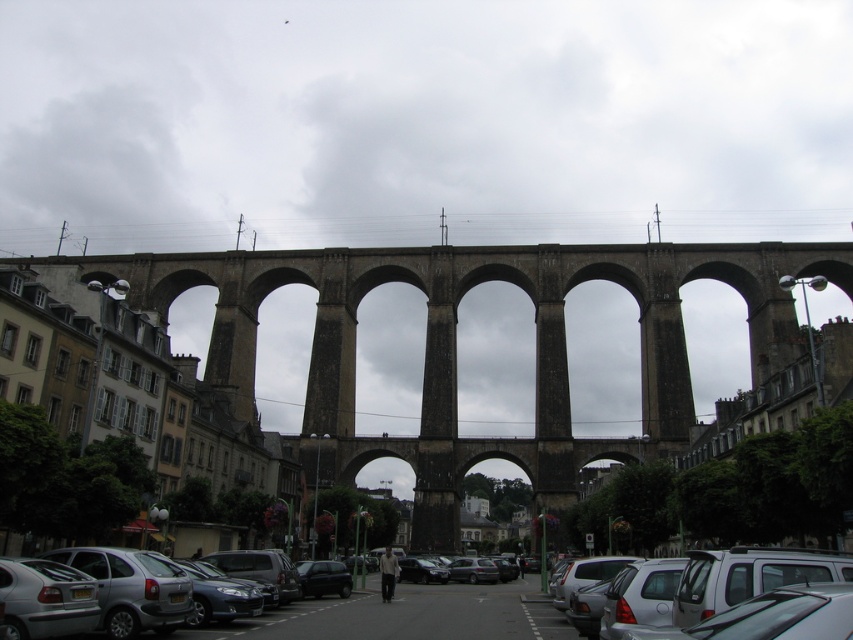
Question: Does silver metallic car at lower left lie in front of shiny black car at center?

Choices:
 (A) no
 (B) yes

Answer: (B)

Question: Can you confirm if brown stone bridge at center is wider than silver metallic car at lower right?

Choices:
 (A) yes
 (B) no

Answer: (A)

Question: Can you confirm if brown stone bridge at center is wider than silver metallic car at lower right?

Choices:
 (A) no
 (B) yes

Answer: (B)

Question: Among these objects, which one is nearest to the camera?

Choices:
 (A) brown stone bridge at center
 (B) silver metallic car at lower left

Answer: (B)

Question: Which point is farther to the camera?

Choices:
 (A) (90, 588)
 (B) (654, 604)
 (C) (343, 572)

Answer: (C)

Question: Which object appears farthest from the camera in this image?

Choices:
 (A) shiny black car at center
 (B) silver metallic car at lower right
 (C) silver metallic car at lower left

Answer: (A)